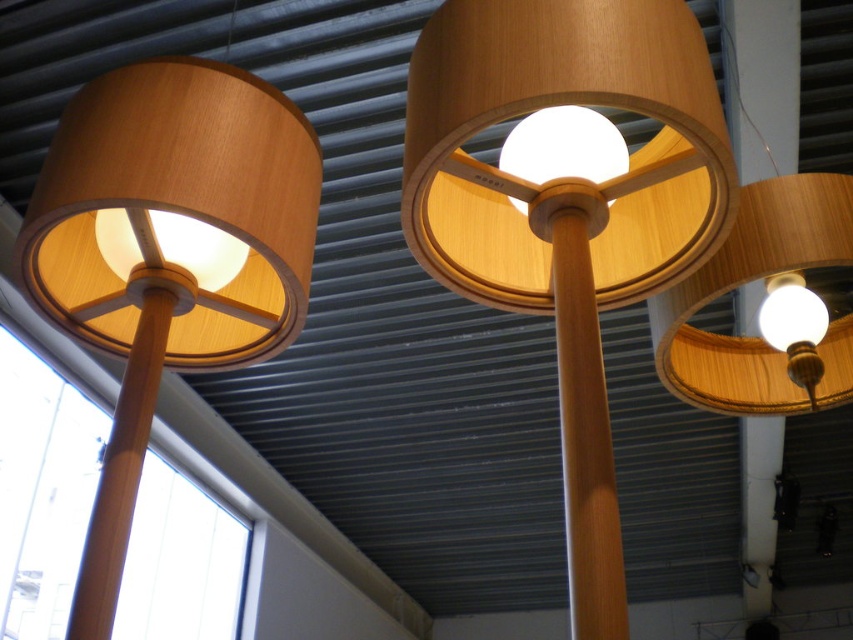
Who is shorter, matte wood table lamp at left or wooden pole at left?

wooden pole at left

Is matte wood table lamp at left shorter than wooden pole at left?

No.

Is point (96, 300) farther from camera compared to point (109, 568)?

Yes.

Where is `matte wood table lamp at left`? matte wood table lamp at left is located at coordinates click(167, 253).

Which is behind, point (746, 273) or point (158, 310)?

Point (746, 273)

Between wooden lampshade at upper right and wooden pole at left, which one appears on the left side from the viewer's perspective?

wooden pole at left

Who is more distant from viewer, (701, 284) or (173, 280)?

The point (701, 284) is behind.

The image size is (853, 640). Identify the location of wooden lampshade at upper right. (770, 289).

Who is positioned more to the left, matte wood table lamp at left or matte wood lampshade at center?

matte wood table lamp at left

This screenshot has height=640, width=853. What do you see at coordinates (167, 253) in the screenshot?
I see `matte wood table lamp at left` at bounding box center [167, 253].

The image size is (853, 640). What are the coordinates of `matte wood table lamp at left` in the screenshot? It's located at (167, 253).